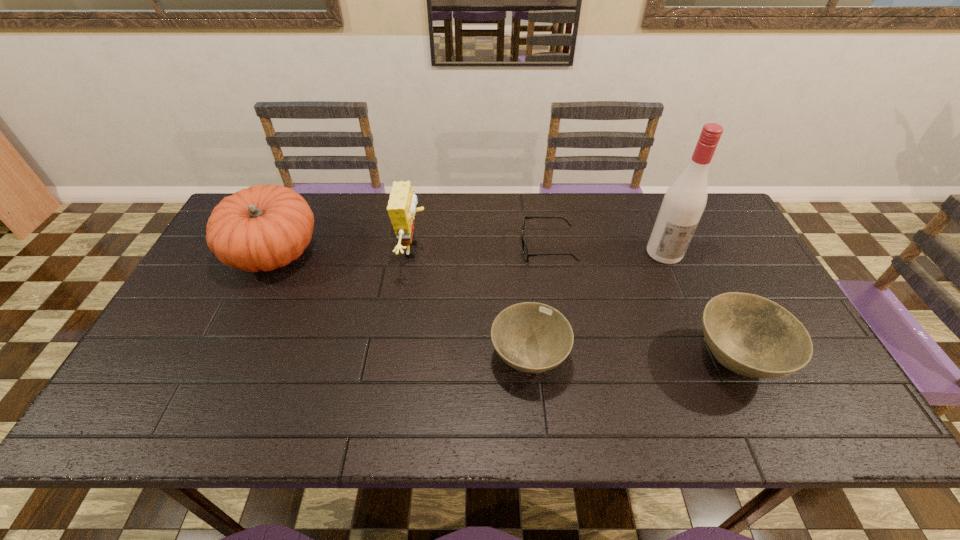
At what (x,y) coordinates should I click in order to perform the action: click on vacant region that satisfies the following two spatial constraints: 1. on the face of the sponge; 2. on the left side of the third shortest object. Please return your answer as a coordinate pair (x, y). Looking at the image, I should click on (397, 360).